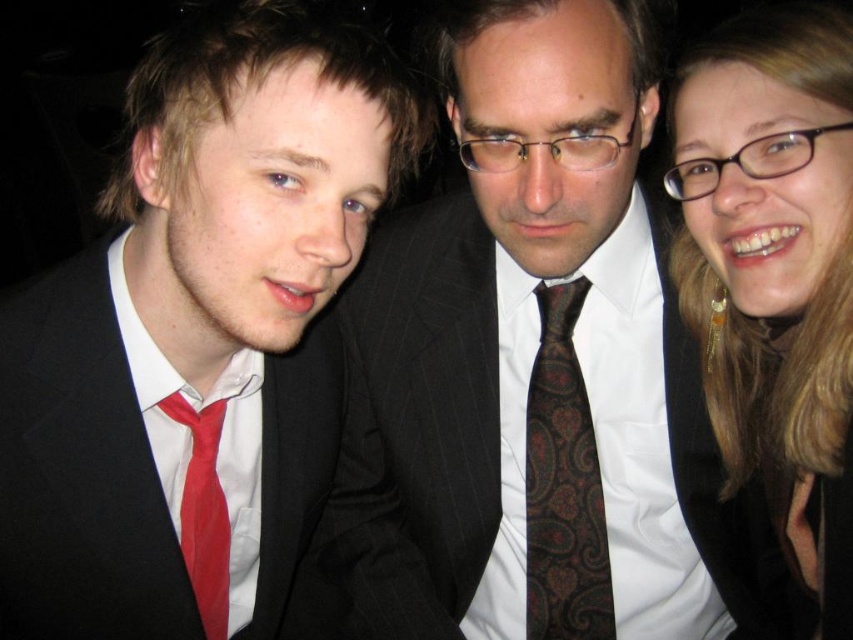
Question: Which point is closer to the camera?

Choices:
 (A) (769, 113)
 (B) (624, 438)
 (C) (200, 572)
 (D) (61, 529)

Answer: (A)

Question: Considering the relative positions of paisley-patterned tie at center and red satin tie at left in the image provided, where is paisley-patterned tie at center located with respect to red satin tie at left?

Choices:
 (A) right
 (B) left

Answer: (A)

Question: Does paisley-patterned tie at center have a larger size compared to matte black suit at left?

Choices:
 (A) no
 (B) yes

Answer: (B)

Question: Is matte black jacket at upper right positioned before matte black suit at left?

Choices:
 (A) yes
 (B) no

Answer: (A)

Question: Which object is the closest to the paisley-patterned tie at center?

Choices:
 (A) matte black suit at left
 (B) matte black jacket at upper right
 (C) brown paisley tie at center

Answer: (C)

Question: Which object is closer to the camera taking this photo?

Choices:
 (A) brown paisley tie at center
 (B) matte black jacket at upper right
 (C) red satin tie at left
 (D) matte black suit at left

Answer: (B)